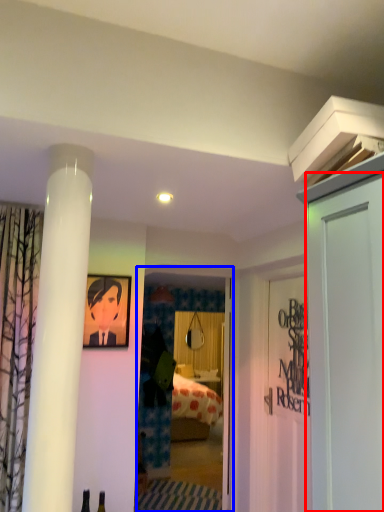
Question: Which of the following is the farthest to the observer, door (highlighted by a red box) or glass door (highlighted by a blue box)?

Choices:
 (A) door
 (B) glass door

Answer: (B)